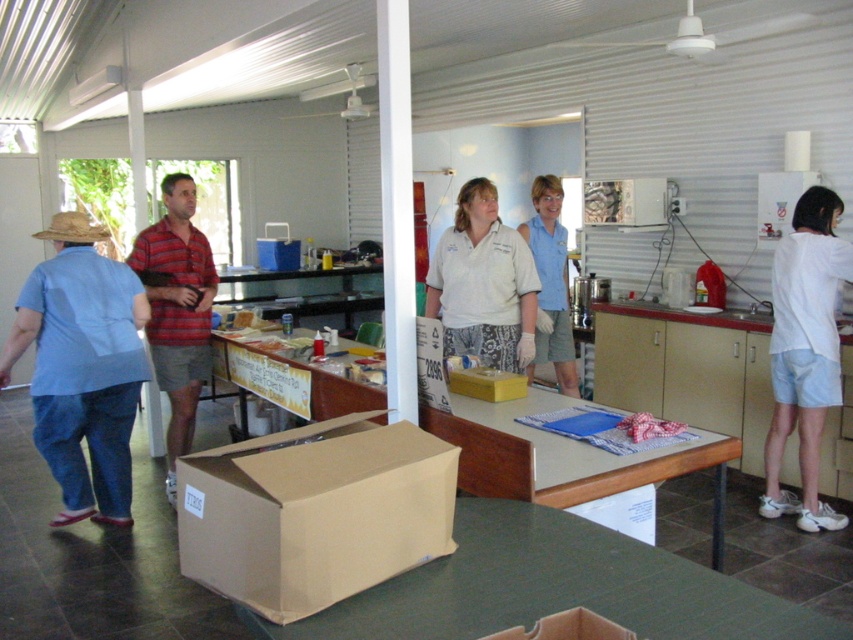
Question: Which point is closer to the camera?

Choices:
 (A) brown cardboard box at center
 (B) white cotton shirt at center
 (C) brown cardboard box at lower center
 (D) yellow cardboard box at center

Answer: (C)

Question: Is brown cardboard box at center positioned at the back of brown cardboard box at lower center?

Choices:
 (A) no
 (B) yes

Answer: (B)

Question: Can you confirm if white cotton shirt at center is thinner than yellow cardboard box at center?

Choices:
 (A) no
 (B) yes

Answer: (A)

Question: Based on their relative distances, which object is nearer to the brown cardboard box at lower center?

Choices:
 (A) brown cardboard box at center
 (B) white cotton shirt at right

Answer: (A)

Question: Which of the following is the closest to the observer?

Choices:
 (A) brown cardboard box at lower center
 (B) blue cotton shirt at center

Answer: (A)

Question: Where is brown cardboard box at center located in relation to blue cotton shirt at center in the image?

Choices:
 (A) below
 (B) above

Answer: (A)